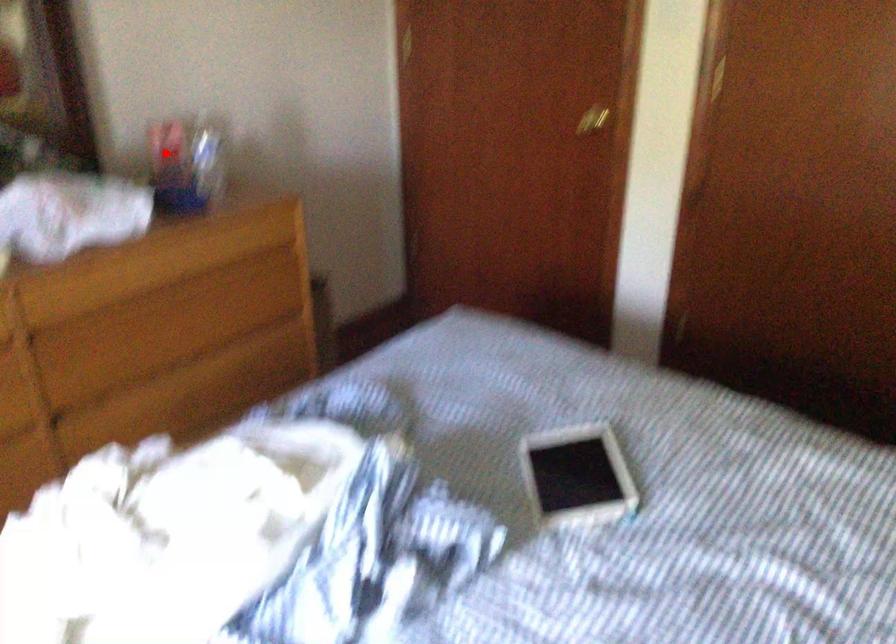
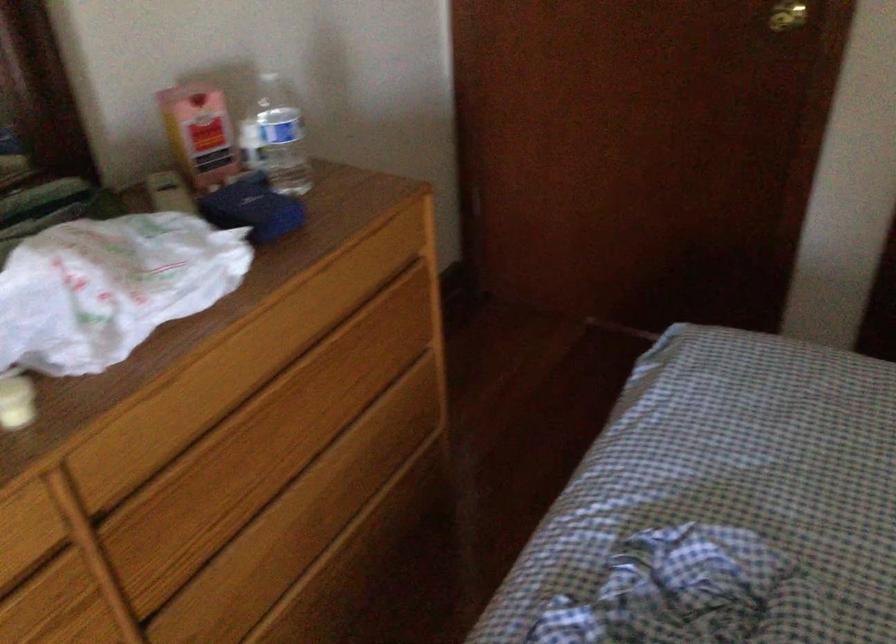
Question: I am providing you with two images of the same scene from different viewpoints. Given a red point in image1, look at the same physical point in image2. Is it:

Choices:
 (A) Closer to the viewpoint
 (B) Farther from the viewpoint

Answer: (A)